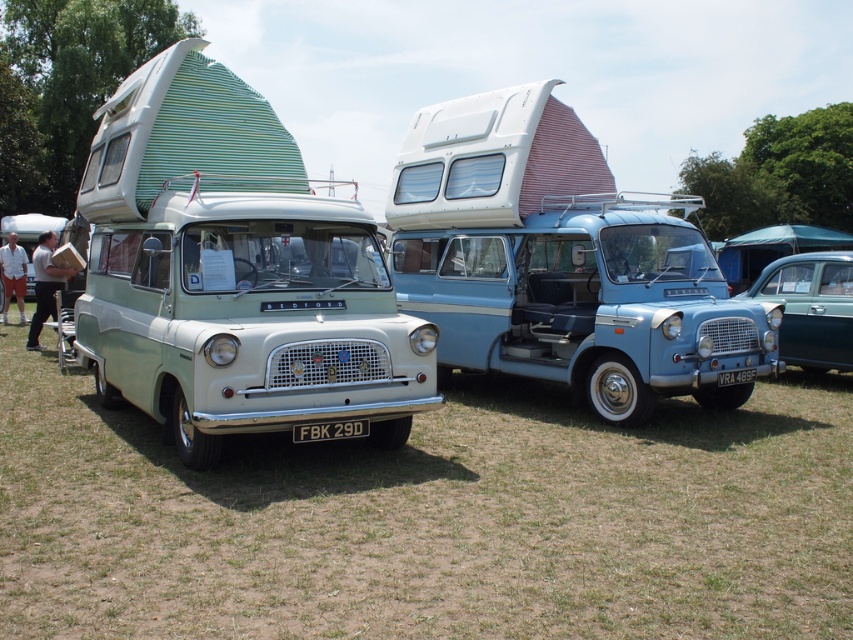
Question: Is light blue metallic van at center below matte green van at center?

Choices:
 (A) yes
 (B) no

Answer: (B)

Question: Which object is positioned closest to the matte green van at center?

Choices:
 (A) white plastic license plate at center
 (B) teal metallic car at center
 (C) light blue metallic van at center

Answer: (A)

Question: Which point is farther to the camera?

Choices:
 (A) (578, 333)
 (B) (825, 362)
 (C) (165, 292)
 (D) (297, 433)

Answer: (B)

Question: Considering the relative positions of light blue metallic van at center and teal metallic car at center in the image provided, where is light blue metallic van at center located with respect to teal metallic car at center?

Choices:
 (A) left
 (B) right

Answer: (A)

Question: Which of the following is the farthest from the observer?

Choices:
 (A) white plastic license plate at center
 (B) teal metallic car at center
 (C) matte green van at center

Answer: (B)

Question: Is matte green van at center below white plastic license plate at center?

Choices:
 (A) yes
 (B) no

Answer: (B)